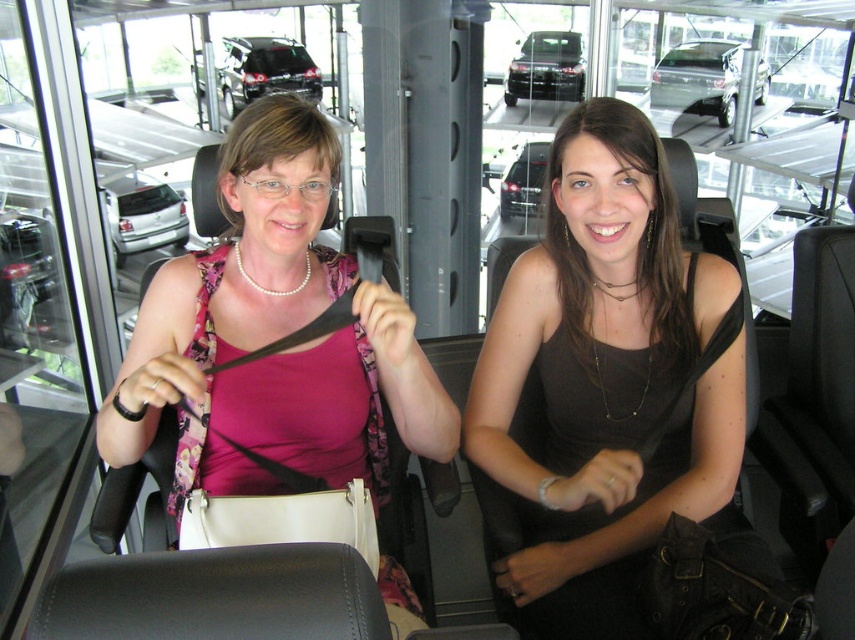
Question: Does matte black tank top at center come in front of matte pink shirt at center?

Choices:
 (A) yes
 (B) no

Answer: (B)

Question: Among these objects, which one is farthest from the camera?

Choices:
 (A) matte black tank top at center
 (B) matte pink shirt at center

Answer: (A)

Question: Where is matte black tank top at center located in relation to matte pink shirt at center in the image?

Choices:
 (A) below
 (B) above

Answer: (A)

Question: Does matte black tank top at center lie behind matte pink shirt at center?

Choices:
 (A) yes
 (B) no

Answer: (A)